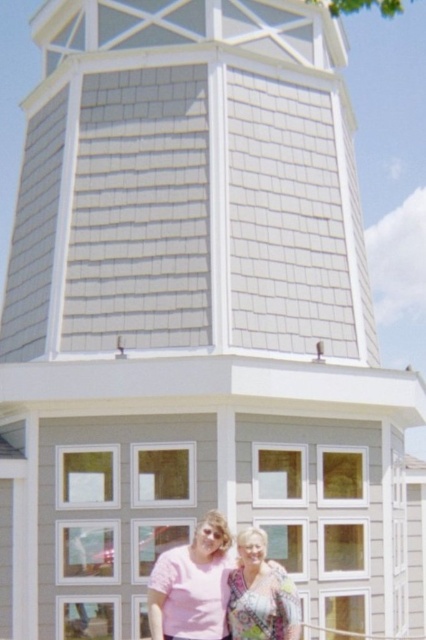
Can you confirm if pink matte shirt at lower center is smaller than patterned fabric blouse at lower center?

No, pink matte shirt at lower center is not smaller than patterned fabric blouse at lower center.

Does pink matte shirt at lower center lie in front of patterned fabric blouse at lower center?

That is False.

Between point (178, 630) and point (262, 621), which one is positioned behind?

The point (178, 630) is behind.

Image resolution: width=426 pixels, height=640 pixels. I want to click on pink matte shirt at lower center, so click(192, 586).